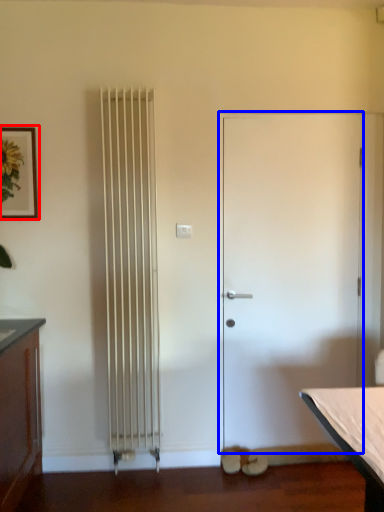
Question: Which of the following is the closest to the observer, picture frame (highlighted by a red box) or door (highlighted by a blue box)?

Choices:
 (A) picture frame
 (B) door

Answer: (A)